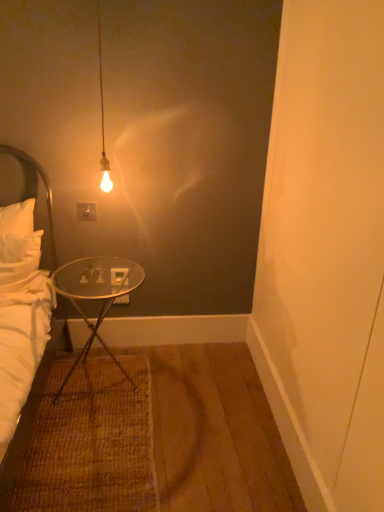
Find the location of a particular element. empty space that is to the right of transparent glass table at lower left is located at coordinates (178, 389).